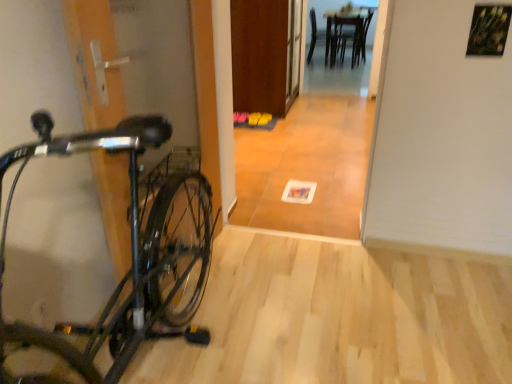
Question: Considering the relative positions of wooden table at center and wooden door at center in the image provided, is wooden table at center in front of wooden door at center?

Choices:
 (A) no
 (B) yes

Answer: (A)

Question: From a real-world perspective, is wooden table at center below wooden door at center?

Choices:
 (A) no
 (B) yes

Answer: (B)

Question: Considering the relative sizes of wooden table at center and wooden door at center in the image provided, is wooden table at center shorter than wooden door at center?

Choices:
 (A) no
 (B) yes

Answer: (B)

Question: Is wooden table at center looking in the opposite direction of wooden door at center?

Choices:
 (A) yes
 (B) no

Answer: (B)

Question: Is wooden table at center thinner than wooden door at center?

Choices:
 (A) yes
 (B) no

Answer: (B)

Question: From a real-world perspective, is wooden table at center located higher than wooden door at center?

Choices:
 (A) yes
 (B) no

Answer: (B)

Question: Does shiny black bicycle at left have a larger size compared to wooden table at center?

Choices:
 (A) no
 (B) yes

Answer: (B)

Question: Can you confirm if shiny black bicycle at left is smaller than wooden table at center?

Choices:
 (A) no
 (B) yes

Answer: (A)

Question: From a real-world perspective, is shiny black bicycle at left on top of wooden table at center?

Choices:
 (A) yes
 (B) no

Answer: (A)

Question: Does shiny black bicycle at left appear on the left side of wooden table at center?

Choices:
 (A) yes
 (B) no

Answer: (A)

Question: Does shiny black bicycle at left have a lesser width compared to wooden table at center?

Choices:
 (A) yes
 (B) no

Answer: (A)

Question: From a real-world perspective, is shiny black bicycle at left positioned under wooden table at center based on gravity?

Choices:
 (A) yes
 (B) no

Answer: (B)

Question: Is wooden table at center to the left of shiny black bicycle at left from the viewer's perspective?

Choices:
 (A) yes
 (B) no

Answer: (B)